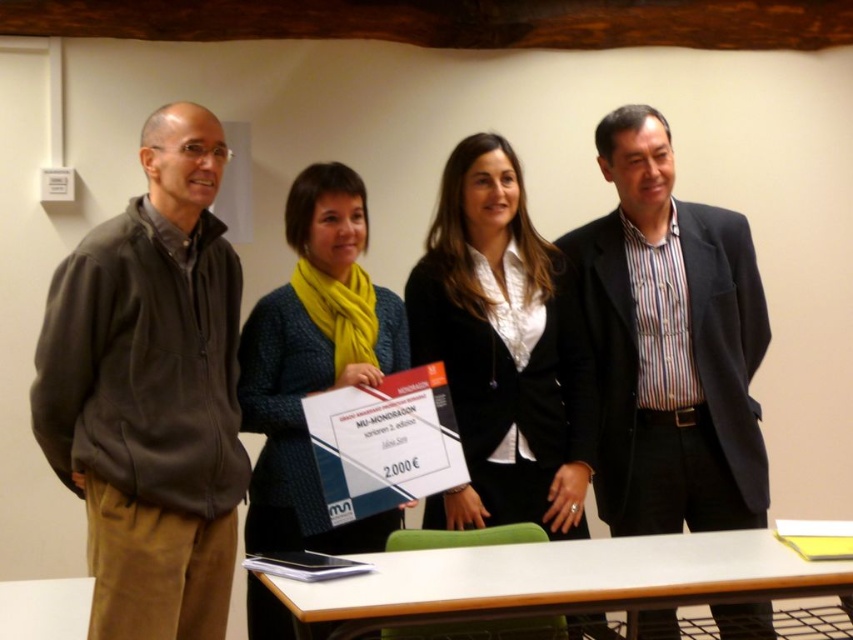
Question: Which object is positioned farthest from the knitted wool scarf at center?

Choices:
 (A) white wood table at lower center
 (B) striped cotton shirt at center
 (C) black matte blazer at center
 (D) dark gray fleece jacket at left

Answer: (B)

Question: Is striped cotton shirt at center thinner than white wood table at lower center?

Choices:
 (A) yes
 (B) no

Answer: (A)

Question: Which point is closer to the camera taking this photo?

Choices:
 (A) (44, 371)
 (B) (248, 493)
 (C) (611, 474)
 (D) (706, 572)

Answer: (A)

Question: Can you confirm if striped cotton shirt at center is positioned below knitted wool scarf at center?

Choices:
 (A) no
 (B) yes

Answer: (A)

Question: Which of the following is the farthest from the observer?

Choices:
 (A) (376, 301)
 (B) (701, 296)
 (C) (529, 259)
 (D) (183, 634)

Answer: (B)

Question: Where is striped cotton shirt at center located in relation to knitted wool scarf at center in the image?

Choices:
 (A) left
 (B) right

Answer: (B)